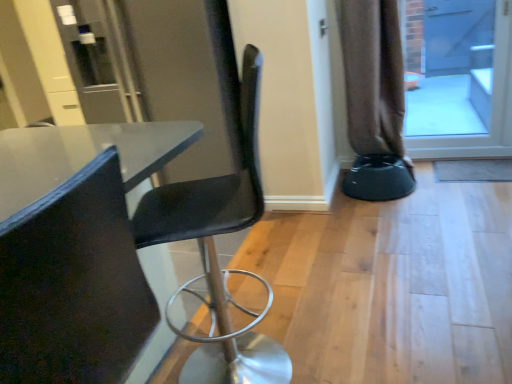
The height and width of the screenshot is (384, 512). I want to click on vacant space behind matte black chair at center, arranged as the first chair when viewed from the back, so click(264, 288).